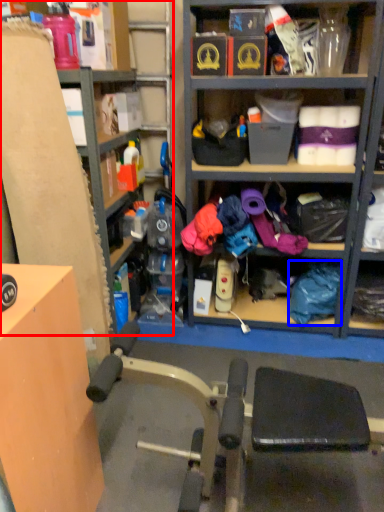
Question: Which of the following is the farthest to the observer, shelf (highlighted by a red box) or clothing (highlighted by a blue box)?

Choices:
 (A) shelf
 (B) clothing

Answer: (B)